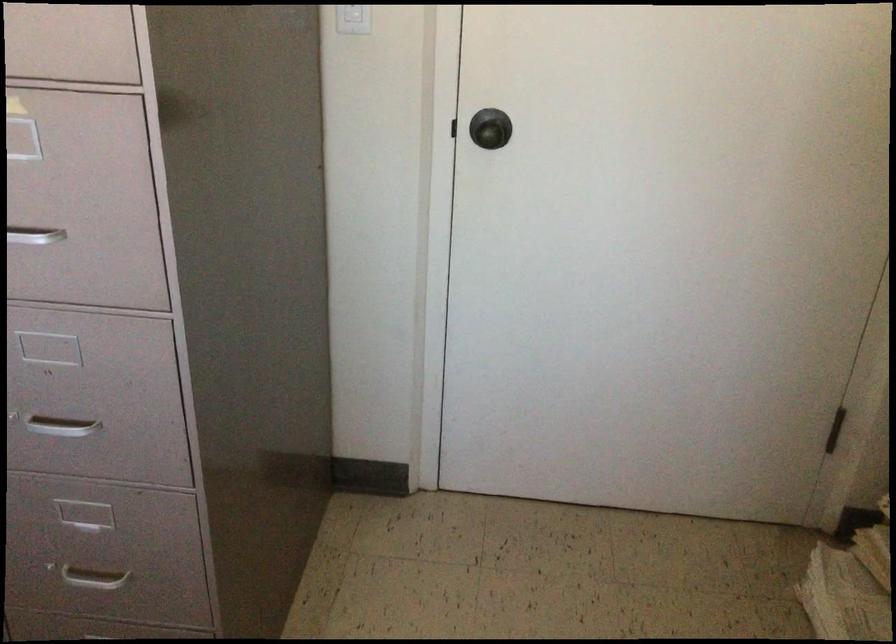
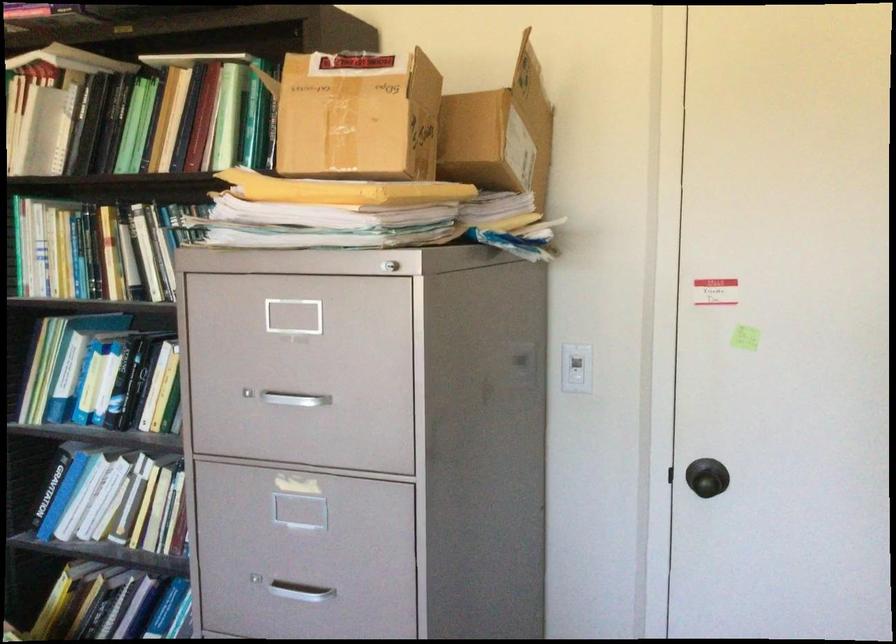
In the second image, find the point that corresponds to [487,136] in the first image.

(707, 482)